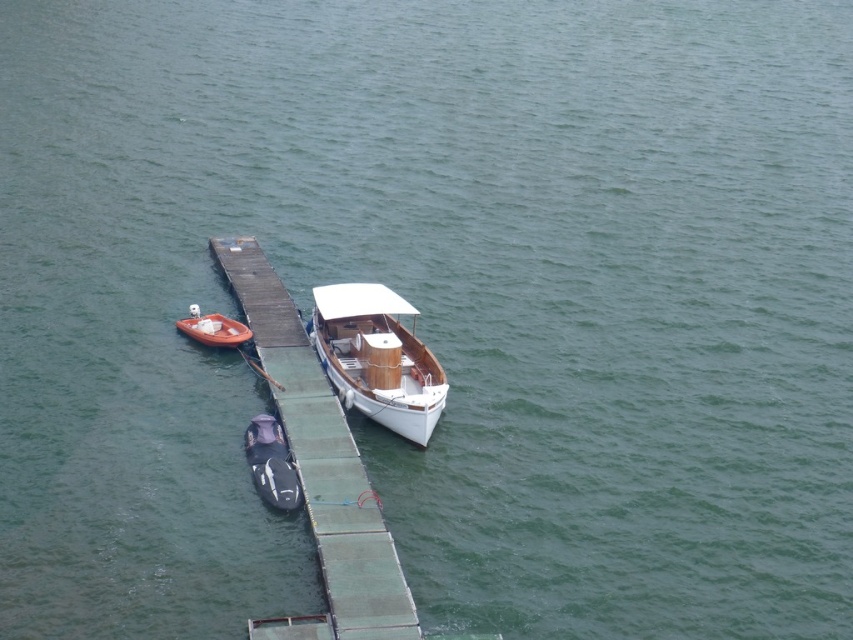
In the scene shown: You are standing on the green wooden dock at center and want to move to the black rubber kayak at center. Is there enough space for you to walk from the dock to the kayak without stepping into the water?

The green wooden dock at center might be wider than black rubber kayak at center, so there might be enough space to walk from the dock to the kayak without stepping into the water, but it is uncertain due to the lack of precise measurements.